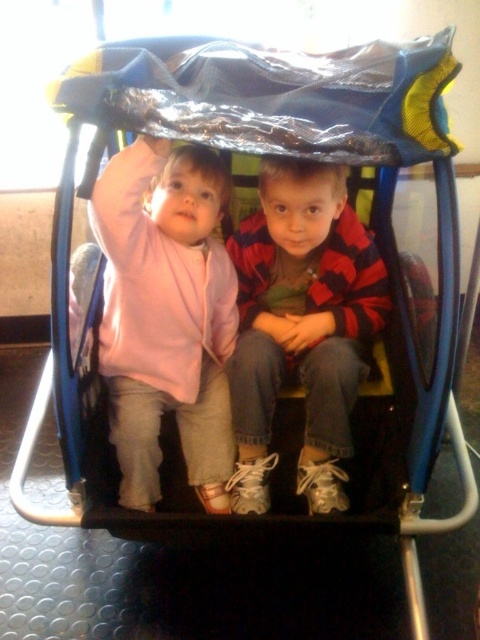
Who is shorter, matte pink sweater at upper left or red plaid shirt at center?

Standing shorter between the two is red plaid shirt at center.

Is matte pink sweater at upper left to the right of red plaid shirt at center from the viewer's perspective?

In fact, matte pink sweater at upper left is to the left of red plaid shirt at center.

Does point (156, 476) come closer to viewer compared to point (345, 308)?

Yes, point (156, 476) is in front of point (345, 308).

Image resolution: width=480 pixels, height=640 pixels. Identify the location of matte pink sweater at upper left. (166, 316).